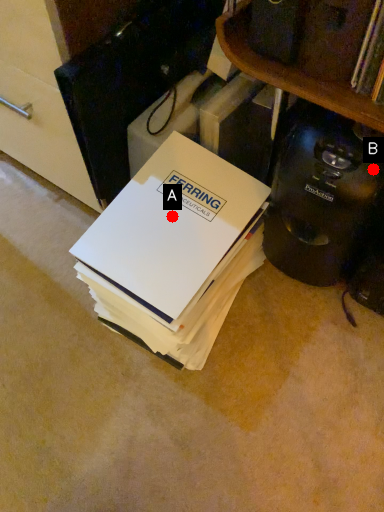
Question: Two points are circled on the image, labeled by A and B beside each circle. Among these points, which one is farthest from the camera?

Choices:
 (A) A is further
 (B) B is further

Answer: (A)